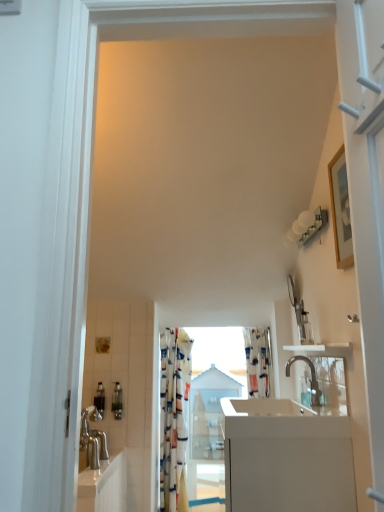
Question: Is the depth of polished chrome faucet at center greater than that of white glossy counter at center?

Choices:
 (A) no
 (B) yes

Answer: (B)

Question: Are polished chrome faucet at center and white glossy counter at center making contact?

Choices:
 (A) yes
 (B) no

Answer: (B)

Question: Is polished chrome faucet at center smaller than white glossy counter at center?

Choices:
 (A) no
 (B) yes

Answer: (B)

Question: From a real-world perspective, is polished chrome faucet at center physically below white glossy counter at center?

Choices:
 (A) yes
 (B) no

Answer: (B)

Question: Is polished chrome faucet at center at the right side of white glossy counter at center?

Choices:
 (A) no
 (B) yes

Answer: (B)

Question: Would you say polished chrome faucet at center is a long distance from white glossy counter at center?

Choices:
 (A) no
 (B) yes

Answer: (A)

Question: Is printed fabric shower curtain at center further to the viewer compared to metallic silver soap dispenser at lower left, arranged as the 2th toiletry when viewed from the left?

Choices:
 (A) yes
 (B) no

Answer: (A)

Question: Is metallic silver soap dispenser at lower left, the first toiletry from the right, at the back of printed fabric shower curtain at center?

Choices:
 (A) no
 (B) yes

Answer: (A)

Question: Considering the relative sizes of printed fabric shower curtain at center and metallic silver soap dispenser at lower left, arranged as the 2th toiletry when viewed from the left, in the image provided, is printed fabric shower curtain at center taller than metallic silver soap dispenser at lower left, arranged as the 2th toiletry when viewed from the left,?

Choices:
 (A) no
 (B) yes

Answer: (B)

Question: From a real-world perspective, is printed fabric shower curtain at center on metallic silver soap dispenser at lower left, arranged as the 2th toiletry when viewed from the left?

Choices:
 (A) no
 (B) yes

Answer: (B)

Question: From a real-world perspective, is printed fabric shower curtain at center located beneath metallic silver soap dispenser at lower left, arranged as the 2th toiletry when viewed from the left?

Choices:
 (A) yes
 (B) no

Answer: (B)

Question: Does printed fabric shower curtain at center contain metallic silver soap dispenser at lower left, arranged as the 2th toiletry when viewed from the left?

Choices:
 (A) no
 (B) yes

Answer: (A)

Question: From a real-world perspective, is metallic silver soap dispenser at lower left, which ranks as the 1th toiletry in left-to-right order, under white glossy counter at center?

Choices:
 (A) no
 (B) yes

Answer: (A)